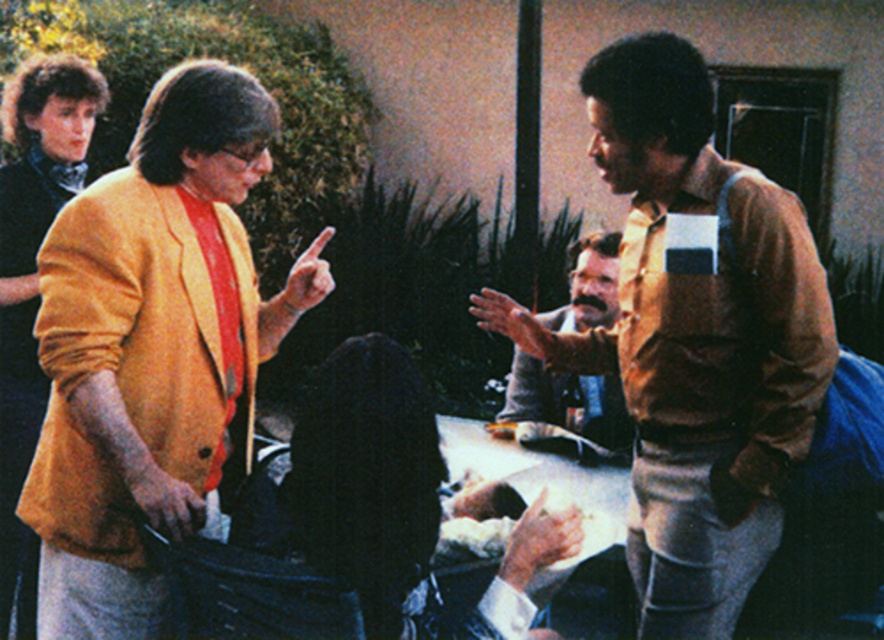
Does point (780, 524) lie behind point (377, 593)?

Yes, it is.

Who is shorter, brown textured shirt at right or black fabric jacket at center?

black fabric jacket at center is shorter.

Who is more distant from viewer, (639, 92) or (390, 388)?

Point (639, 92)

What are the coordinates of `brown textured shirt at right` in the screenshot? It's located at (695, 337).

Who is positioned more to the left, black fabric jacket at center or bearded man at center?

From the viewer's perspective, black fabric jacket at center appears more on the left side.

Consider the image. Is black fabric jacket at center further to camera compared to bearded man at center?

No, black fabric jacket at center is closer to the viewer.

Find the location of a particular element. The image size is (884, 640). black fabric jacket at center is located at coordinates (362, 483).

Does point (84, 612) come farther from viewer compared to point (588, 321)?

No, it is in front of (588, 321).

Does matte yellow jacket at left come in front of bearded man at center?

Yes, it is in front of bearded man at center.

Does point (59, 310) come farther from viewer compared to point (576, 424)?

No, it is in front of (576, 424).

Identify the location of matte yellow jacket at left. The width and height of the screenshot is (884, 640). (153, 349).